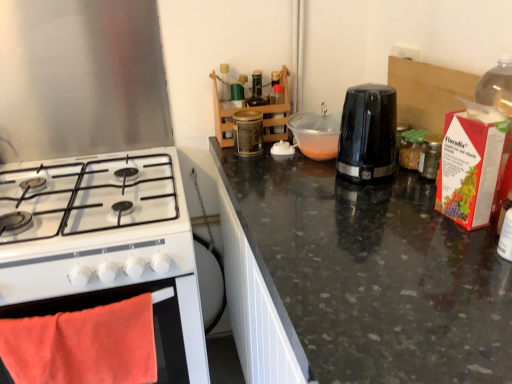
Question: Is black plastic toaster at center, arranged as the second kitchen appliance when viewed from the left, at the left side of white glossy gas stove at left, which appears as the 1th kitchen appliance when viewed from the left?

Choices:
 (A) yes
 (B) no

Answer: (B)

Question: Does black plastic toaster at center, arranged as the second kitchen appliance when viewed from the left, lie in front of white glossy gas stove at left, which is the second kitchen appliance in right-to-left order?

Choices:
 (A) no
 (B) yes

Answer: (A)

Question: Is black plastic toaster at center, the first kitchen appliance from the right, aimed at white glossy gas stove at left, which appears as the 1th kitchen appliance when viewed from the left?

Choices:
 (A) yes
 (B) no

Answer: (A)

Question: Is the position of black plastic toaster at center, the first kitchen appliance from the right, more distant than that of white glossy gas stove at left, which is the second kitchen appliance in right-to-left order?

Choices:
 (A) yes
 (B) no

Answer: (A)

Question: Considering the relative positions of black plastic toaster at center, arranged as the second kitchen appliance when viewed from the left, and white glossy gas stove at left, which appears as the 1th kitchen appliance when viewed from the left, in the image provided, is black plastic toaster at center, arranged as the second kitchen appliance when viewed from the left, to the right of white glossy gas stove at left, which appears as the 1th kitchen appliance when viewed from the left, from the viewer's perspective?

Choices:
 (A) no
 (B) yes

Answer: (B)

Question: From their relative heights in the image, would you say black plastic toaster at center, the first kitchen appliance from the right, is taller or shorter than white glossy gas stove at left, which is the second kitchen appliance in right-to-left order?

Choices:
 (A) tall
 (B) short

Answer: (A)

Question: From the image's perspective, is black plastic toaster at center, the first kitchen appliance from the right, above or below white glossy gas stove at left, which is the second kitchen appliance in right-to-left order?

Choices:
 (A) below
 (B) above

Answer: (B)

Question: Is black plastic toaster at center, the first kitchen appliance from the right, bigger or smaller than white glossy gas stove at left, which is the second kitchen appliance in right-to-left order?

Choices:
 (A) big
 (B) small

Answer: (B)

Question: Do you think black plastic toaster at center, arranged as the second kitchen appliance when viewed from the left, is within white glossy gas stove at left, which is the second kitchen appliance in right-to-left order, or outside of it?

Choices:
 (A) outside
 (B) inside

Answer: (A)

Question: In terms of height, does orange fabric oven at lower left look taller or shorter compared to white glossy gas stove at left, which is the second kitchen appliance in right-to-left order?

Choices:
 (A) tall
 (B) short

Answer: (A)

Question: Based on their sizes in the image, would you say orange fabric oven at lower left is bigger or smaller than white glossy gas stove at left, which is the second kitchen appliance in right-to-left order?

Choices:
 (A) small
 (B) big

Answer: (A)

Question: Do you think orange fabric oven at lower left is within white glossy gas stove at left, which appears as the 1th kitchen appliance when viewed from the left, or outside of it?

Choices:
 (A) inside
 (B) outside

Answer: (B)

Question: Would you say orange fabric oven at lower left is to the left or to the right of white glossy gas stove at left, which appears as the 1th kitchen appliance when viewed from the left, in the picture?

Choices:
 (A) right
 (B) left

Answer: (A)

Question: In terms of height, does orange fabric oven at lower left look taller or shorter compared to black plastic toaster at center, the first kitchen appliance from the right?

Choices:
 (A) short
 (B) tall

Answer: (B)

Question: From the image's perspective, is orange fabric oven at lower left positioned above or below black plastic toaster at center, the first kitchen appliance from the right?

Choices:
 (A) below
 (B) above

Answer: (A)